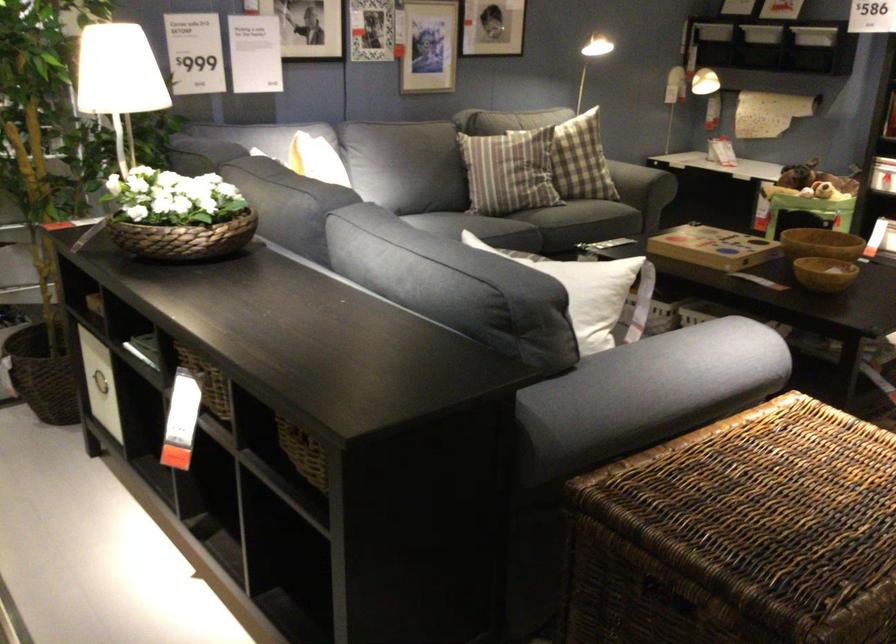
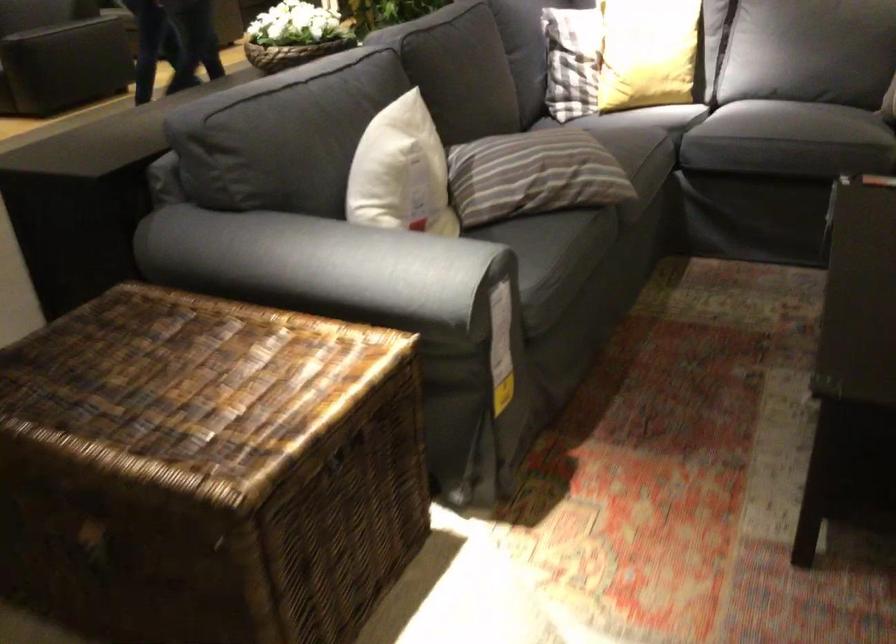
The point at (513, 241) is marked in the first image. Where is the corresponding point in the second image?

(768, 122)